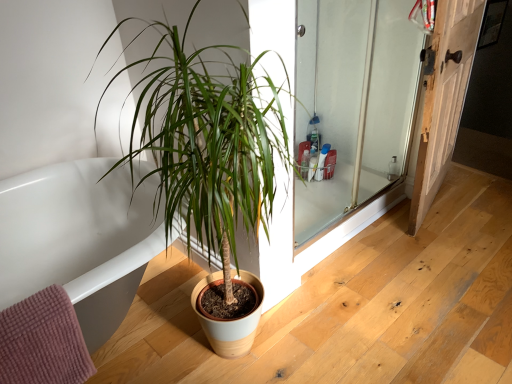
Question: Should I look upward or downward to see wooden door at right?

Choices:
 (A) up
 (B) down

Answer: (A)

Question: Can you confirm if clear glass screen door at right is taller than white glossy bathtub at lower left?

Choices:
 (A) yes
 (B) no

Answer: (A)

Question: From the image's perspective, does clear glass screen door at right appear lower than white glossy bathtub at lower left?

Choices:
 (A) yes
 (B) no

Answer: (B)

Question: Does clear glass screen door at right have a larger size compared to white glossy bathtub at lower left?

Choices:
 (A) no
 (B) yes

Answer: (A)

Question: Would you say clear glass screen door at right is outside white glossy bathtub at lower left?

Choices:
 (A) yes
 (B) no

Answer: (A)

Question: Is clear glass screen door at right looking in the opposite direction of white glossy bathtub at lower left?

Choices:
 (A) no
 (B) yes

Answer: (A)

Question: Is clear glass screen door at right closer to the viewer compared to white glossy bathtub at lower left?

Choices:
 (A) no
 (B) yes

Answer: (A)

Question: Is white glossy bathtub at lower left directly adjacent to clear glass screen door at right?

Choices:
 (A) yes
 (B) no

Answer: (B)

Question: Considering the relative sizes of white glossy bathtub at lower left and clear glass screen door at right in the image provided, is white glossy bathtub at lower left smaller than clear glass screen door at right?

Choices:
 (A) yes
 (B) no

Answer: (B)

Question: Is white glossy bathtub at lower left at the left side of clear glass screen door at right?

Choices:
 (A) no
 (B) yes

Answer: (B)

Question: Would you consider white glossy bathtub at lower left to be distant from clear glass screen door at right?

Choices:
 (A) no
 (B) yes

Answer: (B)

Question: Is white glossy bathtub at lower left taller than clear glass screen door at right?

Choices:
 (A) no
 (B) yes

Answer: (A)

Question: From the image's perspective, does white glossy bathtub at lower left appear higher than clear glass screen door at right?

Choices:
 (A) no
 (B) yes

Answer: (A)

Question: Is there a large distance between white glossy bathtub at lower left and wooden door at right?

Choices:
 (A) yes
 (B) no

Answer: (A)